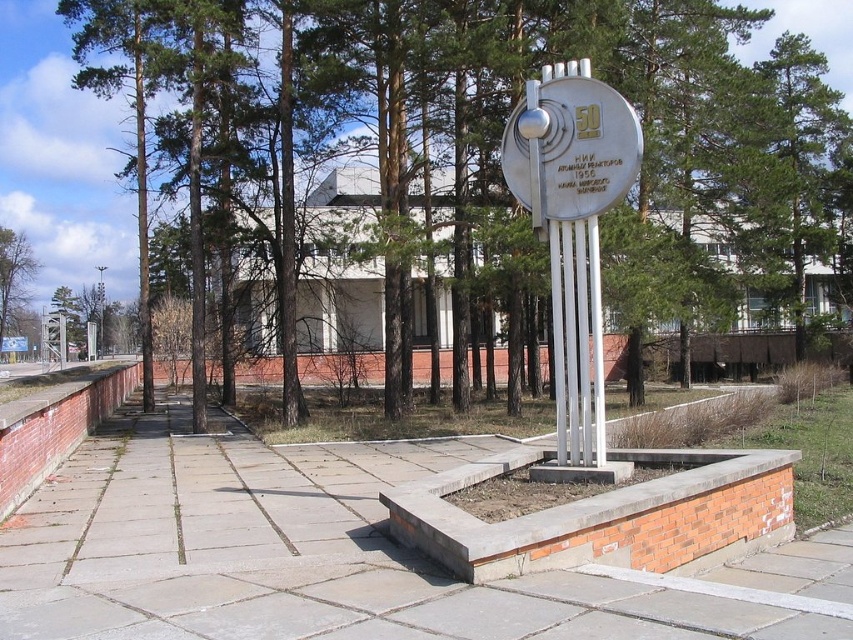
You are a gardener who needs to mow the gray concrete pavement at center and the green leafy tree at left. Which object can you mow?

The gray concrete pavement at center has a lesser height compared to green leafy tree at left. You cannot mow the gray concrete pavement at center as it is a hard surface, and you cannot mow the green leafy tree at left as it is a tree.

Looking at this image, you are a gardener planning to plant flowers between the gray concrete pavement at center and the green leafy tree at left. Which area has more space available for planting?

The green leafy tree at left has more space available for planting since the gray concrete pavement at center occupies less space than it.